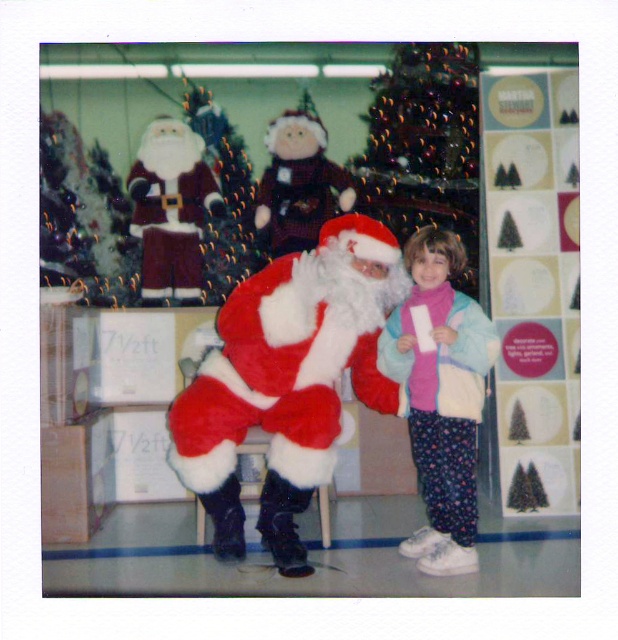
You are a photographer trying to capture a photo of both the fuzzy red santa at center and the shiny green christmas tree at upper left. Based on their positions, which one would appear larger in the photo?

The fuzzy red santa at center appears larger in the photo because it is closer to the viewer than the shiny green christmas tree at upper left.